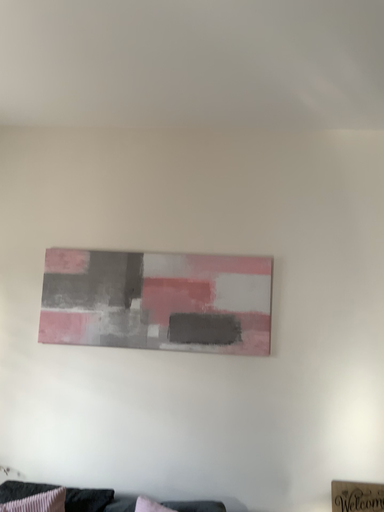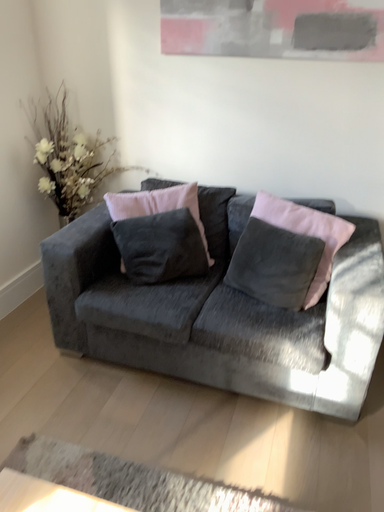
Question: Which way did the camera rotate in the video?

Choices:
 (A) rotated upward
 (B) rotated downward

Answer: (B)